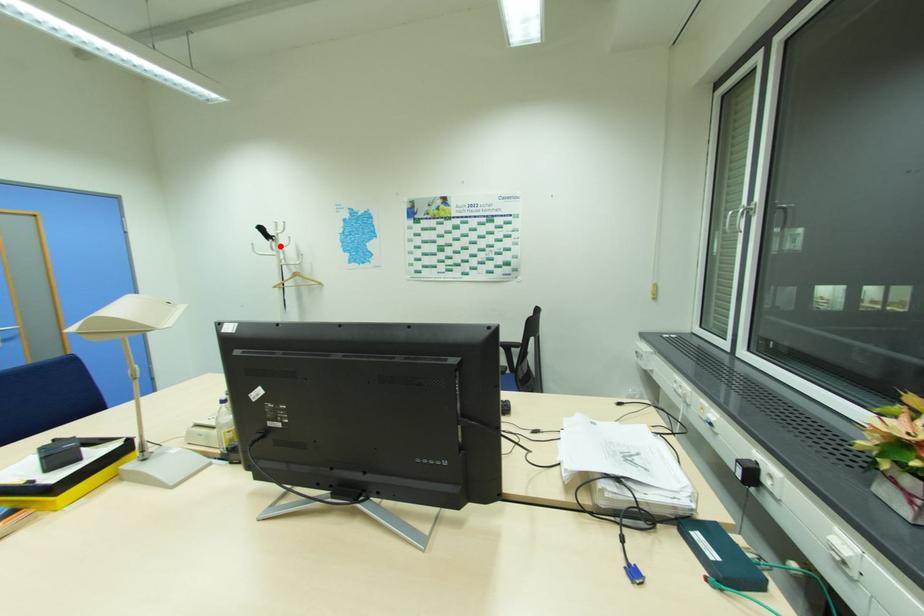
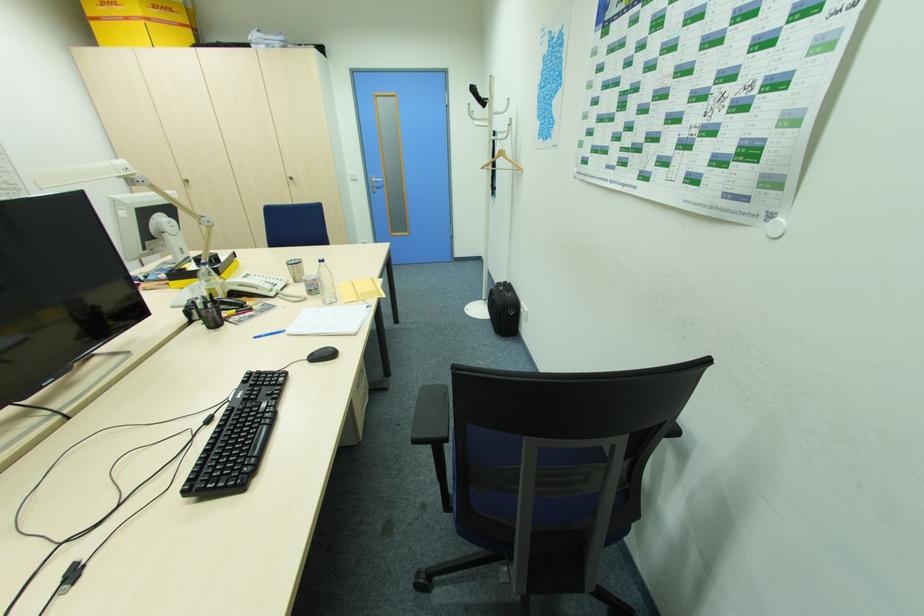
The point at the highlighted location is marked in the first image. Where is the corresponding point in the second image?

(493, 113)